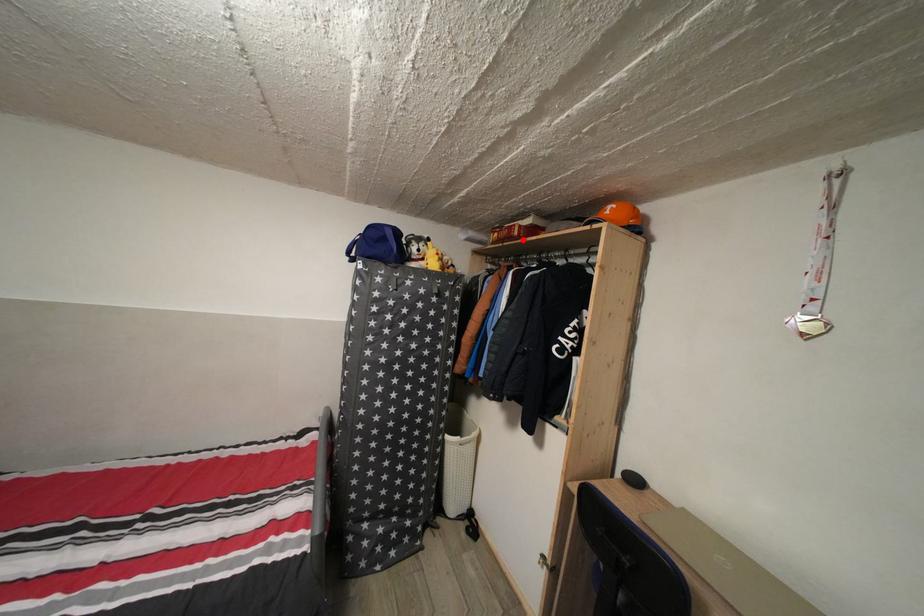
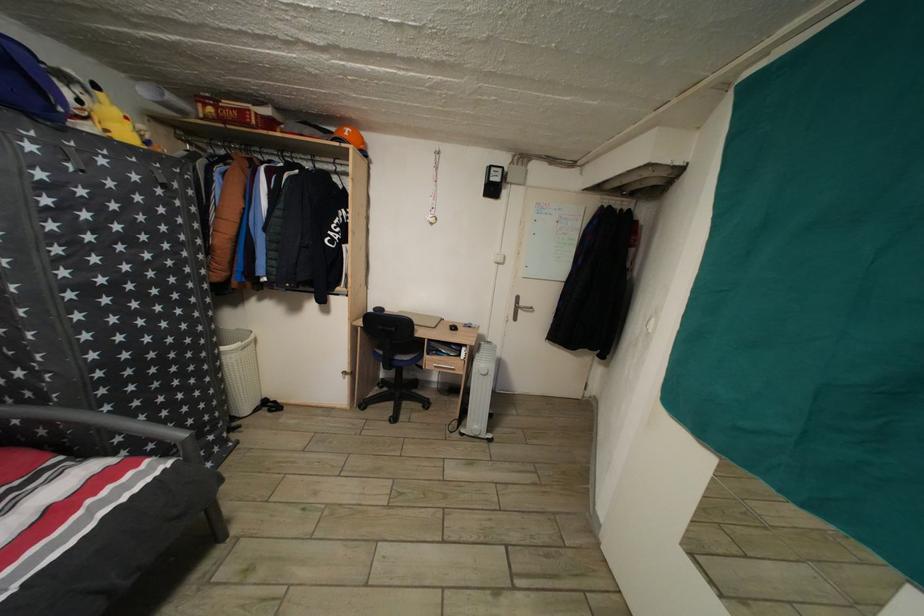
In the second image, find the point that corresponds to the highlighted location in the first image.

(261, 129)